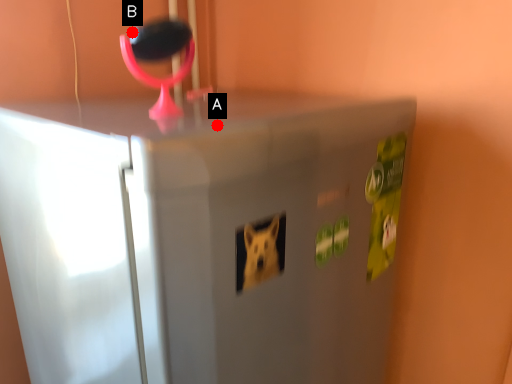
Question: Two points are circled on the image, labeled by A and B beside each circle. Which point appears farthest from the camera in this image?

Choices:
 (A) A is further
 (B) B is further

Answer: (A)